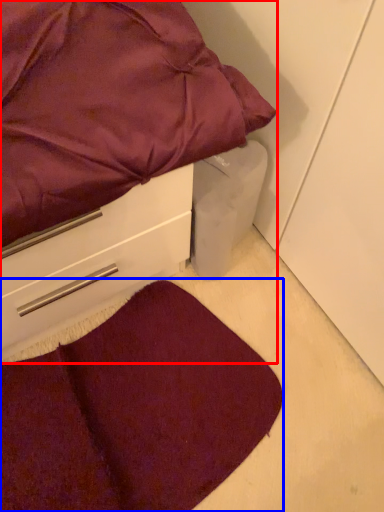
Question: Which object is further to the camera taking this photo, bed (highlighted by a red box) or mat (highlighted by a blue box)?

Choices:
 (A) bed
 (B) mat

Answer: (B)